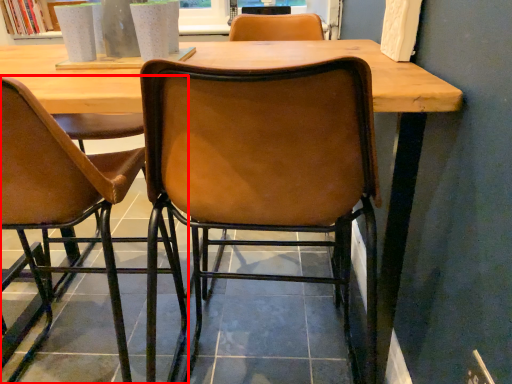
Question: From the image, what is the correct spatial relationship of chair (annotated by the red box) in relation to chair?

Choices:
 (A) left
 (B) right

Answer: (A)